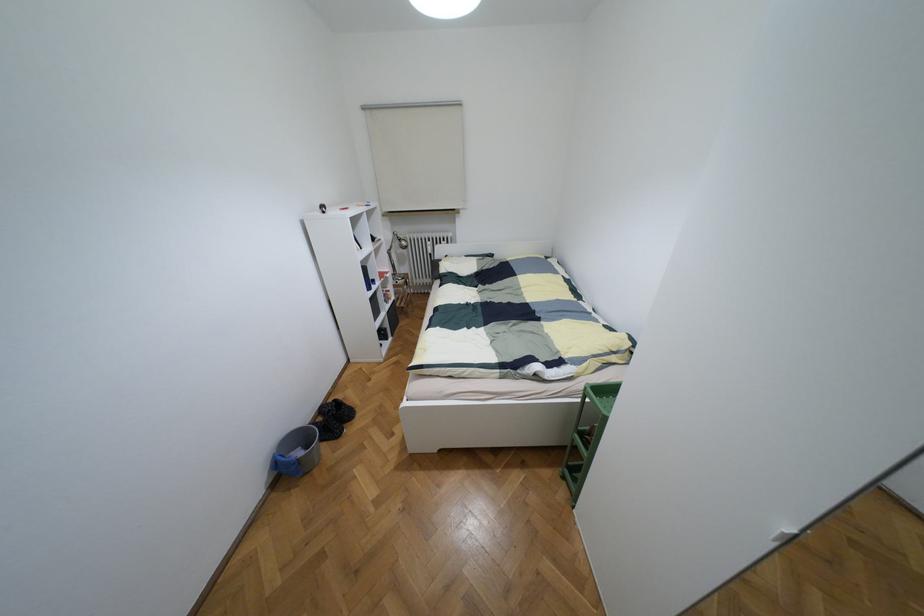
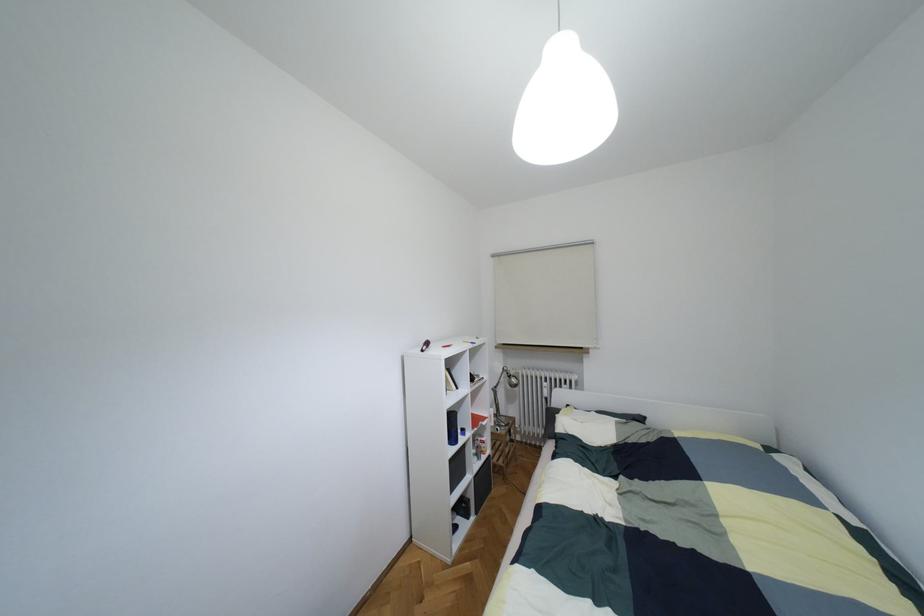
In the second image, find the point that corresponds to [398,238] in the first image.

(508, 376)